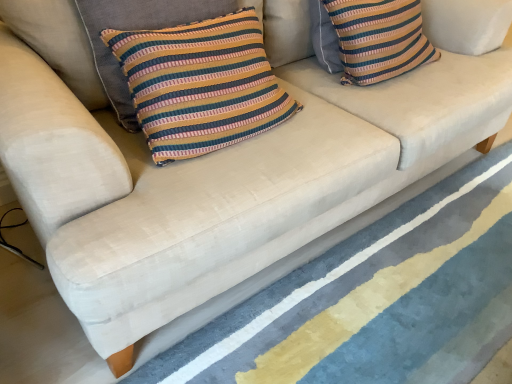
At what (x,y) coordinates should I click in order to perform the action: click on textured blue rug at lower center. Please return your answer as a coordinate pair (x, y). The height and width of the screenshot is (384, 512). Looking at the image, I should click on (380, 297).

How much space does striped fabric pillow at upper right, the first pillow when ordered from back to front, occupy vertically?

The height of striped fabric pillow at upper right, the first pillow when ordered from back to front, is 10.98 inches.

Find the location of a particular element. striped fabric pillow at center, the first pillow viewed from the front is located at coordinates (137, 29).

I want to click on textured blue rug at lower center, so click(x=380, y=297).

Which is more to the left, striped fabric pillow at center, placed as the 2th pillow when sorted from back to front, or textured blue rug at lower center?

Positioned to the left is striped fabric pillow at center, placed as the 2th pillow when sorted from back to front.

Does striped fabric pillow at center, placed as the 2th pillow when sorted from back to front, have a larger size compared to textured blue rug at lower center?

No, striped fabric pillow at center, placed as the 2th pillow when sorted from back to front, is not bigger than textured blue rug at lower center.

Considering the sizes of objects striped fabric pillow at center, the first pillow viewed from the front, and textured blue rug at lower center in the image provided, who is thinner, striped fabric pillow at center, the first pillow viewed from the front, or textured blue rug at lower center?

striped fabric pillow at center, the first pillow viewed from the front, is thinner.

Is striped fabric pillow at center, the first pillow in the left-to-right sequence, in front of textured blue rug at lower center?

That is False.

Which object is wider, striped fabric pillow at center, the first pillow viewed from the front, or striped fabric pillow at upper right, arranged as the 1th pillow when viewed from the right?

Wider between the two is striped fabric pillow at upper right, arranged as the 1th pillow when viewed from the right.

Is striped fabric pillow at center, the second pillow positioned from the right, not inside striped fabric pillow at upper right, arranged as the 1th pillow when viewed from the right?

Yes, striped fabric pillow at center, the second pillow positioned from the right, is not within striped fabric pillow at upper right, arranged as the 1th pillow when viewed from the right.

From a real-world perspective, is striped fabric pillow at center, placed as the 2th pillow when sorted from back to front, physically below striped fabric pillow at upper right, marked as the second pillow in a front-to-back arrangement?

No, from a real-world perspective, striped fabric pillow at center, placed as the 2th pillow when sorted from back to front, is not under striped fabric pillow at upper right, marked as the second pillow in a front-to-back arrangement.

Locate an element on the screen. The image size is (512, 384). pillow below the striped fabric pillow at upper right, acting as the 2th pillow starting from the left (from the image's perspective) is located at coordinates (137, 29).

What's the angular difference between textured blue rug at lower center and striped fabric pillow at upper right, marked as the second pillow in a front-to-back arrangement,'s facing directions?

90 degrees separate the facing orientations of textured blue rug at lower center and striped fabric pillow at upper right, marked as the second pillow in a front-to-back arrangement.

Considering the positions of objects textured blue rug at lower center and striped fabric pillow at upper right, the first pillow when ordered from back to front, in the image provided, who is more to the left, textured blue rug at lower center or striped fabric pillow at upper right, the first pillow when ordered from back to front,?

Positioned to the left is striped fabric pillow at upper right, the first pillow when ordered from back to front.

Is textured blue rug at lower center directly adjacent to striped fabric pillow at upper right, the first pillow when ordered from back to front?

textured blue rug at lower center and striped fabric pillow at upper right, the first pillow when ordered from back to front, are clearly separated.

From the image's perspective, which one is positioned higher, striped fabric pillow at upper right, marked as the second pillow in a front-to-back arrangement, or striped fabric pillow at center, the first pillow viewed from the front?

From the image's view, striped fabric pillow at upper right, marked as the second pillow in a front-to-back arrangement, is above.

Between striped fabric pillow at upper right, arranged as the 1th pillow when viewed from the right, and striped fabric pillow at center, the first pillow in the left-to-right sequence, which one is positioned behind?

striped fabric pillow at upper right, arranged as the 1th pillow when viewed from the right, is more distant.

In terms of size, does striped fabric pillow at upper right, marked as the second pillow in a front-to-back arrangement, appear bigger or smaller than striped fabric pillow at center, the first pillow viewed from the front?

Considering their sizes, striped fabric pillow at upper right, marked as the second pillow in a front-to-back arrangement, takes up more space than striped fabric pillow at center, the first pillow viewed from the front.

Is striped fabric pillow at upper right, the first pillow when ordered from back to front, positioned with its back to textured blue rug at lower center?

No, striped fabric pillow at upper right, the first pillow when ordered from back to front, is not facing the opposite direction of textured blue rug at lower center.

In terms of width, does striped fabric pillow at upper right, acting as the 2th pillow starting from the left, look wider or thinner when compared to textured blue rug at lower center?

Considering their sizes, striped fabric pillow at upper right, acting as the 2th pillow starting from the left, looks slimmer than textured blue rug at lower center.

Consider the image. Would you consider striped fabric pillow at upper right, acting as the 2th pillow starting from the left, to be distant from textured blue rug at lower center?

striped fabric pillow at upper right, acting as the 2th pillow starting from the left, is near textured blue rug at lower center, not far away.

Between striped fabric pillow at upper right, the first pillow when ordered from back to front, and textured blue rug at lower center, which one appears on the left side from the viewer's perspective?

striped fabric pillow at upper right, the first pillow when ordered from back to front, is more to the left.

From the image's perspective, which one is positioned lower, textured blue rug at lower center or striped fabric pillow at center, the first pillow viewed from the front?

textured blue rug at lower center, from the image's perspective.

Is textured blue rug at lower center oriented towards striped fabric pillow at center, the second pillow positioned from the right?

No, textured blue rug at lower center is not aimed at striped fabric pillow at center, the second pillow positioned from the right.

Is textured blue rug at lower center thinner than striped fabric pillow at center, placed as the 2th pillow when sorted from back to front?

No, textured blue rug at lower center is not thinner than striped fabric pillow at center, placed as the 2th pillow when sorted from back to front.

In order to click on stripe below the striped fabric pillow at center, placed as the 2th pillow when sorted from back to front (from a real-world perspective) in this screenshot , I will do [380, 297].

The image size is (512, 384). I want to click on pillow to the left of striped fabric pillow at upper right, the first pillow when ordered from back to front, so [137, 29].

Which object lies further to the anchor point striped fabric pillow at upper right, arranged as the 1th pillow when viewed from the right, textured blue rug at lower center or striped fabric pillow at center, the first pillow in the left-to-right sequence?

textured blue rug at lower center lies further to striped fabric pillow at upper right, arranged as the 1th pillow when viewed from the right, than the other object.

Based on their spatial positions, is textured blue rug at lower center or striped fabric pillow at upper right, acting as the 2th pillow starting from the left, further from striped fabric pillow at center, placed as the 2th pillow when sorted from back to front?

textured blue rug at lower center.

When comparing their distances from striped fabric pillow at center, the first pillow in the left-to-right sequence, does striped fabric pillow at upper right, the first pillow when ordered from back to front, or textured blue rug at lower center seem further?

textured blue rug at lower center.

When comparing their distances from textured blue rug at lower center, does striped fabric pillow at upper right, the first pillow when ordered from back to front, or striped fabric pillow at center, the first pillow viewed from the front, seem closer?

Among the two, striped fabric pillow at upper right, the first pillow when ordered from back to front, is located nearer to textured blue rug at lower center.

Considering their positions, is striped fabric pillow at center, the second pillow positioned from the right, positioned closer to striped fabric pillow at upper right, acting as the 2th pillow starting from the left, than textured blue rug at lower center?

striped fabric pillow at center, the second pillow positioned from the right, is positioned closer to the anchor striped fabric pillow at upper right, acting as the 2th pillow starting from the left.

Which object lies nearer to the anchor point textured blue rug at lower center, striped fabric pillow at center, the second pillow positioned from the right, or striped fabric pillow at upper right, marked as the second pillow in a front-to-back arrangement?

striped fabric pillow at upper right, marked as the second pillow in a front-to-back arrangement, is closer to textured blue rug at lower center.

Identify the location of pillow between striped fabric pillow at upper right, marked as the second pillow in a front-to-back arrangement, and textured blue rug at lower center from top to bottom. (137, 29).